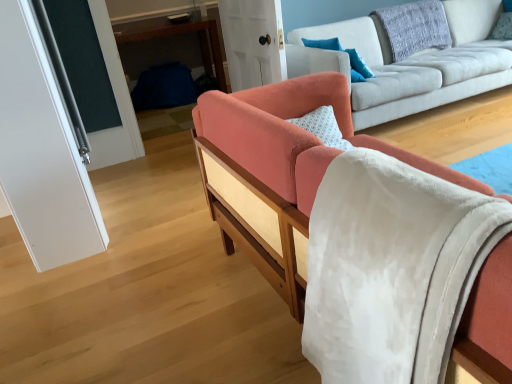
Question: Is light gray fabric couch at center, the first studio couch positioned from the back, bigger or smaller than clear glass door at upper left, which is the first glass door in left-to-right order?

Choices:
 (A) small
 (B) big

Answer: (B)

Question: Looking at their shapes, would you say light gray fabric couch at center, the first studio couch positioned from the back, is wider or thinner than clear glass door at upper left, acting as the 2th glass door starting from the back?

Choices:
 (A) thin
 (B) wide

Answer: (B)

Question: Estimate the real-world distances between objects in this image. Which object is closer to the blue textured pillow at upper center, which is counted as the 1th pillow, starting from the left?

Choices:
 (A) textured gray pillow at upper right, which appears as the second pillow when viewed from the right
 (B) blue textured pillow at upper right, the first pillow when ordered from right to left
 (C) light gray fabric couch at center, the second studio couch from the front
 (D) clear glass door at upper left, which is the first glass door in left-to-right order
 (E) blue fabric table at center

Answer: (C)

Question: Considering the real-world distances, which object is closest to the blue textured pillow at upper center, marked as the 3th pillow in a right-to-left arrangement?

Choices:
 (A) transparent glass door at upper center, the first glass door from the right
 (B) clear glass door at upper left, acting as the 2th glass door starting from the back
 (C) textured gray pillow at upper right, the second pillow positioned from the left
 (D) coral fabric couch at center, which ranks as the 2th studio couch in back-to-front order
 (E) light gray fabric couch at center, the first studio couch positioned from the back

Answer: (A)